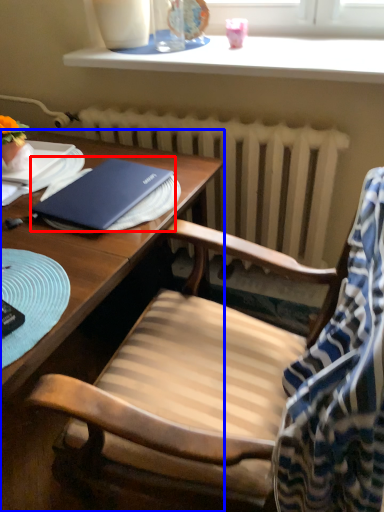
Question: Which of the following is the farthest to the observer, notebook (highlighted by a red box) or desk (highlighted by a blue box)?

Choices:
 (A) notebook
 (B) desk

Answer: (A)